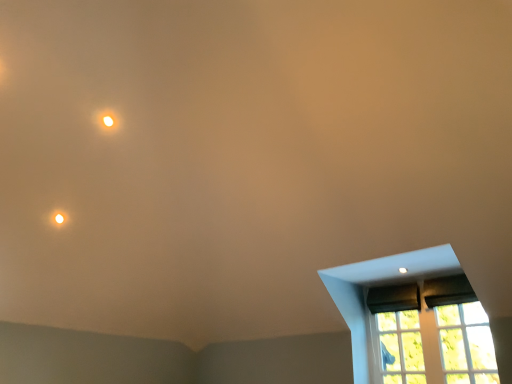
Question: Can you confirm if matte white light at upper left is smaller than clear glass window at lower right, the first glass window when ordered from left to right?

Choices:
 (A) yes
 (B) no

Answer: (A)

Question: Considering the relative sizes of matte white light at upper left and clear glass window at lower right, the first glass window when ordered from left to right, in the image provided, is matte white light at upper left thinner than clear glass window at lower right, the first glass window when ordered from left to right,?

Choices:
 (A) yes
 (B) no

Answer: (B)

Question: Is matte white light at upper left completely or partially outside of clear glass window at lower right, the first glass window when ordered from left to right?

Choices:
 (A) no
 (B) yes

Answer: (B)

Question: Is matte white light at upper left to the right of clear glass window at lower right, which appears as the second glass window when viewed from the right, from the viewer's perspective?

Choices:
 (A) yes
 (B) no

Answer: (B)

Question: Is matte white light at upper left positioned behind clear glass window at lower right, the first glass window when ordered from left to right?

Choices:
 (A) yes
 (B) no

Answer: (A)

Question: Is matte white light at upper left far away from clear glass window at lower right, which appears as the second glass window when viewed from the right?

Choices:
 (A) yes
 (B) no

Answer: (A)

Question: Could you tell me if matte black window at lower right is facing matte white light at upper left?

Choices:
 (A) no
 (B) yes

Answer: (A)

Question: Can you confirm if matte black window at lower right is thinner than matte white light at upper left?

Choices:
 (A) yes
 (B) no

Answer: (B)

Question: Is matte black window at lower right at the left side of matte white light at upper left?

Choices:
 (A) no
 (B) yes

Answer: (A)

Question: Is matte black window at lower right oriented away from matte white light at upper left?

Choices:
 (A) yes
 (B) no

Answer: (B)

Question: Does matte black window at lower right come behind matte white light at upper left?

Choices:
 (A) yes
 (B) no

Answer: (B)

Question: From the image's perspective, is matte black window at lower right on top of matte white light at upper left?

Choices:
 (A) yes
 (B) no

Answer: (B)

Question: Is transparent glass window at lower right, the second glass window positioned from the left, not near matte white light at upper left?

Choices:
 (A) yes
 (B) no

Answer: (A)